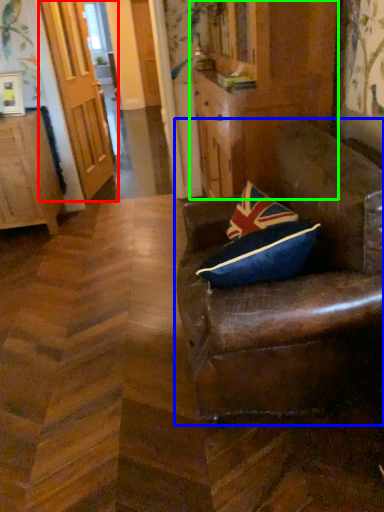
Question: Which object is the farthest from door (highlighted by a red box)? Choose among these: chair (highlighted by a blue box) or dresser (highlighted by a green box).

Choices:
 (A) chair
 (B) dresser

Answer: (A)